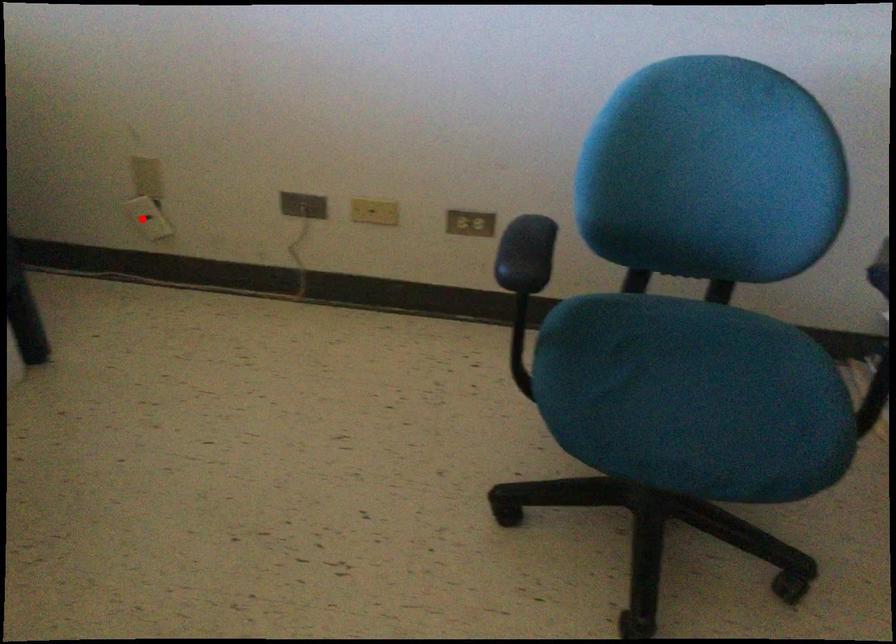
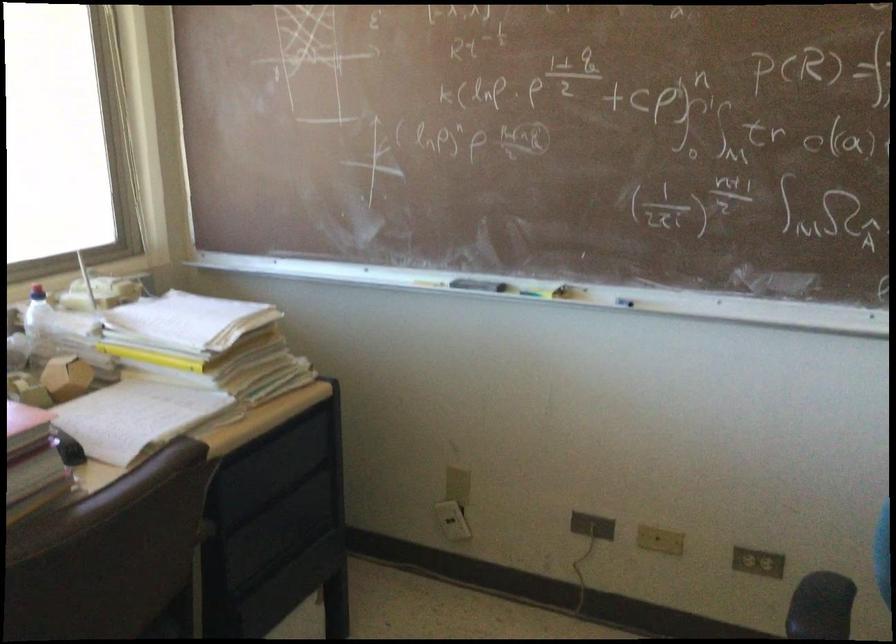
Question: A red point is marked in image1. In image2, is the corresponding 3D point closer to the camera or farther? Reply with the corresponding letter.

Choices:
 (A) The corresponding 3D point is closer.
 (B) The corresponding 3D point is farther.

Answer: (B)